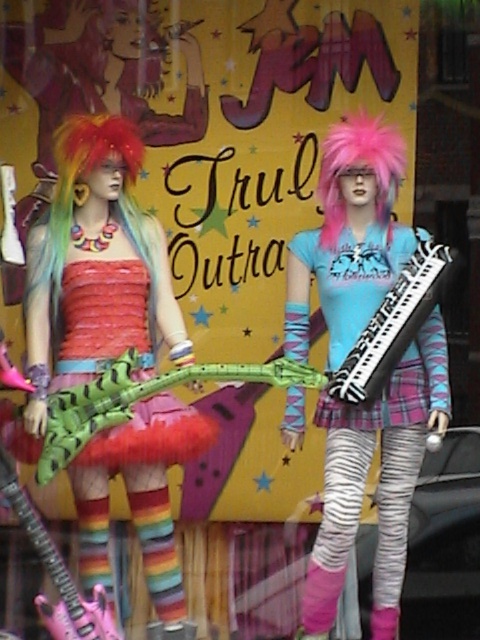
Who is shorter, green matte plastic toy at center or multicolored synthetic wig at left?

multicolored synthetic wig at left is shorter.

What do you see at coordinates (104, 308) in the screenshot? I see `green matte plastic toy at center` at bounding box center [104, 308].

What are the coordinates of `green matte plastic toy at center` in the screenshot? It's located at (104, 308).

Which is in front, point (163, 330) or point (419, 275)?

Point (419, 275)

Does matte pink guitar at left have a greater width compared to black and white keyboard at center?

Indeed, matte pink guitar at left has a greater width compared to black and white keyboard at center.

Between point (160, 272) and point (381, 381), which one is positioned behind?

Positioned behind is point (160, 272).

Where is `matte pink guitar at left`? The width and height of the screenshot is (480, 640). matte pink guitar at left is located at coordinates (93, 273).

Does point (447, 273) come in front of point (359, 141)?

That is True.

Does black and white keyboard at center appear on the left side of pink fluffy wig at center?

In fact, black and white keyboard at center is to the right of pink fluffy wig at center.

Who is more forward, (338,374) or (387,216)?

Point (338,374) is more forward.

The height and width of the screenshot is (640, 480). Identify the location of black and white keyboard at center. (394, 323).